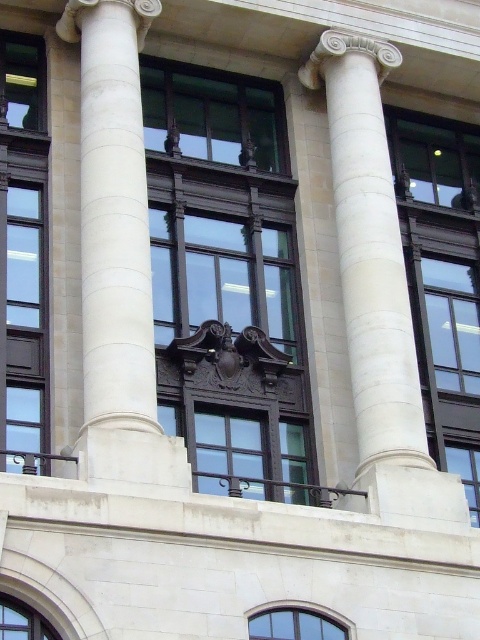
Question: Which object appears farthest from the camera in this image?

Choices:
 (A) white marble column at center
 (B) glossy dark wood window at center

Answer: (B)

Question: Among these objects, which one is farthest from the camera?

Choices:
 (A) clear glass window at lower left
 (B) matte black window at center

Answer: (B)

Question: Is white marble column at center wider than white stone column at center?

Choices:
 (A) no
 (B) yes

Answer: (B)

Question: Can you confirm if matte glass window at left is positioned below glossy dark wood window at center?

Choices:
 (A) no
 (B) yes

Answer: (A)

Question: Among these points, which one is farthest from the camera?

Choices:
 (A) (x=380, y=422)
 (B) (x=176, y=65)

Answer: (B)

Question: Does white marble column at center have a lesser width compared to clear glass window at lower left?

Choices:
 (A) yes
 (B) no

Answer: (B)